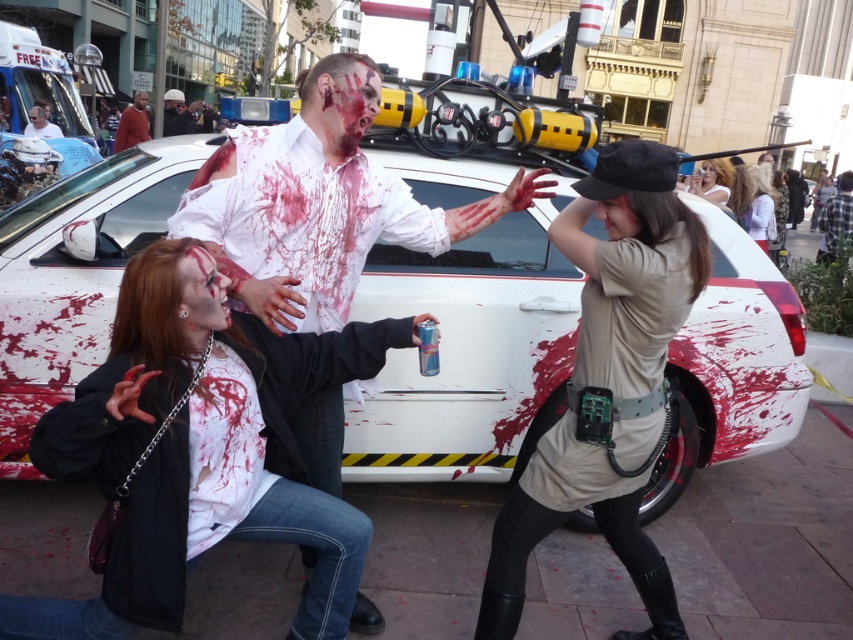
Question: Can you confirm if light brown hair at upper right is bigger than matte black jacket at center?

Choices:
 (A) yes
 (B) no

Answer: (B)

Question: Which of the following is the closest to the observer?

Choices:
 (A) (770, 216)
 (B) (38, 129)
 (C) (164, 198)

Answer: (C)

Question: Is white plastic ambulance at upper left positioned at the back of matte black jacket at center?

Choices:
 (A) no
 (B) yes

Answer: (A)

Question: Among these points, which one is nearest to the camera?

Choices:
 (A) (759, 224)
 (B) (589, 292)
 (C) (135, 134)

Answer: (B)

Question: Is white matte car at center behind light brown hair at upper right?

Choices:
 (A) yes
 (B) no

Answer: (B)

Question: Which point is closer to the camera?

Choices:
 (A) smooth plastic helmet at upper left
 (B) blonde hair wig at upper right

Answer: (B)